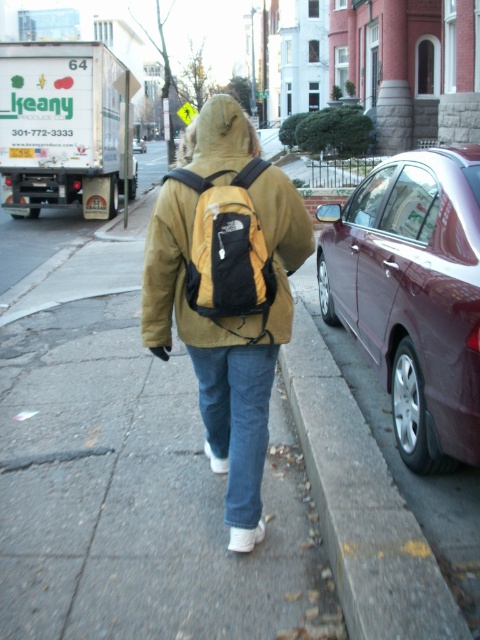
Question: Does concrete at lower right lie in front of maroon metallic sedan at center?

Choices:
 (A) yes
 (B) no

Answer: (A)

Question: Among these objects, which one is nearest to the camera?

Choices:
 (A) concrete at lower right
 (B) yellow matte backpack at center

Answer: (A)

Question: Which object appears farthest from the camera in this image?

Choices:
 (A) shiny maroon sedan at right
 (B) matte yellow jacket at center
 (C) concrete at lower right

Answer: (B)

Question: Is yellow matte backpack at center below denim jeans at lower center?

Choices:
 (A) yes
 (B) no

Answer: (B)

Question: Which point is farther to the camera?

Choices:
 (A) concrete at lower right
 (B) shiny maroon sedan at right
 (C) matte yellow jacket at center
 (D) maroon metallic sedan at center

Answer: (D)

Question: Is the position of concrete at lower right more distant than that of maroon metallic sedan at center?

Choices:
 (A) no
 (B) yes

Answer: (A)